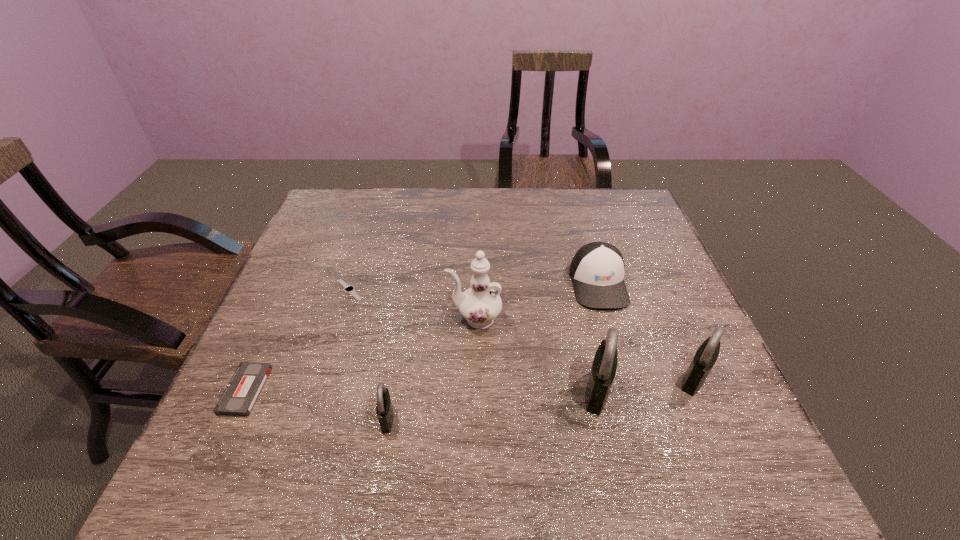
In the image, there is a desktop. Identify the location of vacant space at the left edge. (292, 279).

In the image, there is a desktop. Where is `free space at the right edge`? The width and height of the screenshot is (960, 540). free space at the right edge is located at coordinates (603, 231).

Identify the location of free space at the far left corner of the desktop. (339, 215).

At what (x,y) coordinates should I click in order to perform the action: click on vacant space at the far right corner of the desktop. Please return your answer as a coordinate pair (x, y). The width and height of the screenshot is (960, 540). Looking at the image, I should click on (609, 217).

The height and width of the screenshot is (540, 960). Find the location of `free space at the near right corner`. free space at the near right corner is located at coordinates (730, 401).

Locate an element on the screen. This screenshot has width=960, height=540. free space between the cap and the fourth object from right to left is located at coordinates (537, 301).

Find the location of a particular element. free area in between the cap and the third object from left to right is located at coordinates (492, 351).

Find the location of a particular element. The height and width of the screenshot is (540, 960). free spot between the chinaware and the cap is located at coordinates (537, 301).

Where is `free spot between the tallest object and the cap`? free spot between the tallest object and the cap is located at coordinates (537, 301).

Locate an element on the screen. This screenshot has width=960, height=540. blank region between the cap and the shortest padlock is located at coordinates (492, 351).